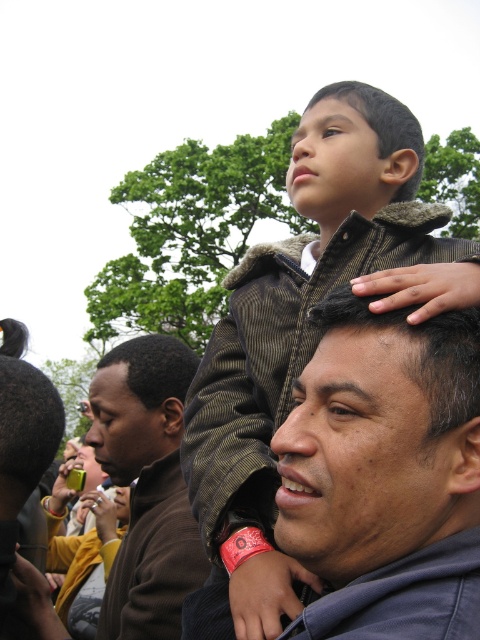
Question: Among these points, which one is farthest from the camera?

Choices:
 (A) (405, 108)
 (B) (435, 307)
 (C) (156, 452)

Answer: (C)

Question: From the image, what is the correct spatial relationship of brown corduroy jacket at upper center in relation to dark brown hair at center?

Choices:
 (A) above
 (B) below

Answer: (A)

Question: Does brown fleece jacket at left appear under brown fuzzy jacket at upper center?

Choices:
 (A) yes
 (B) no

Answer: (A)

Question: Is brown corduroy jacket at upper center wider than brown fuzzy jacket at upper center?

Choices:
 (A) yes
 (B) no

Answer: (A)

Question: Which point is farther from the camera taking this photo?

Choices:
 (A) (135, 396)
 (B) (339, 168)

Answer: (A)

Question: Estimate the real-world distances between objects in this image. Which object is closer to the brown woolen head at center?

Choices:
 (A) brown fuzzy jacket at upper center
 (B) dark brown hair at center
 (C) brown corduroy jacket at upper center

Answer: (C)